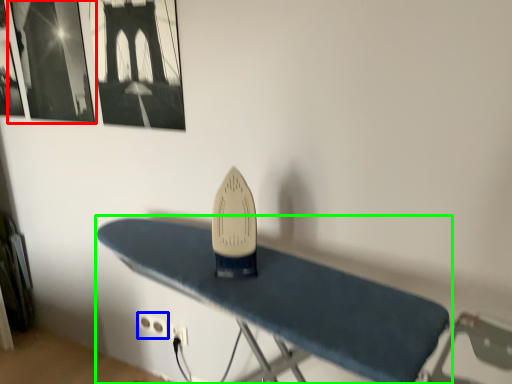
Question: Based on their relative distances, which object is farther from picture frame (highlighted by a red box)? Choose from plug (highlighted by a blue box) and furniture (highlighted by a green box).

Choices:
 (A) plug
 (B) furniture

Answer: (A)